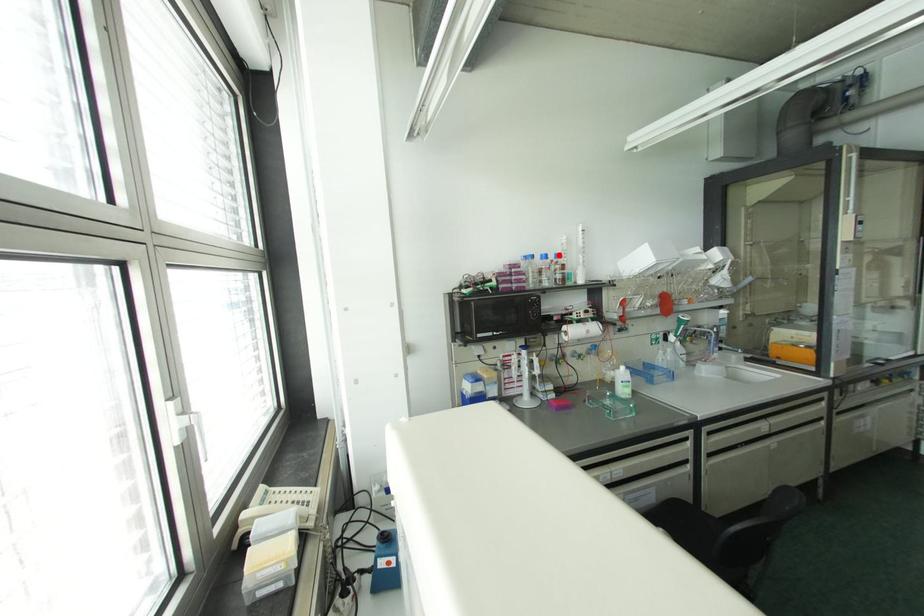
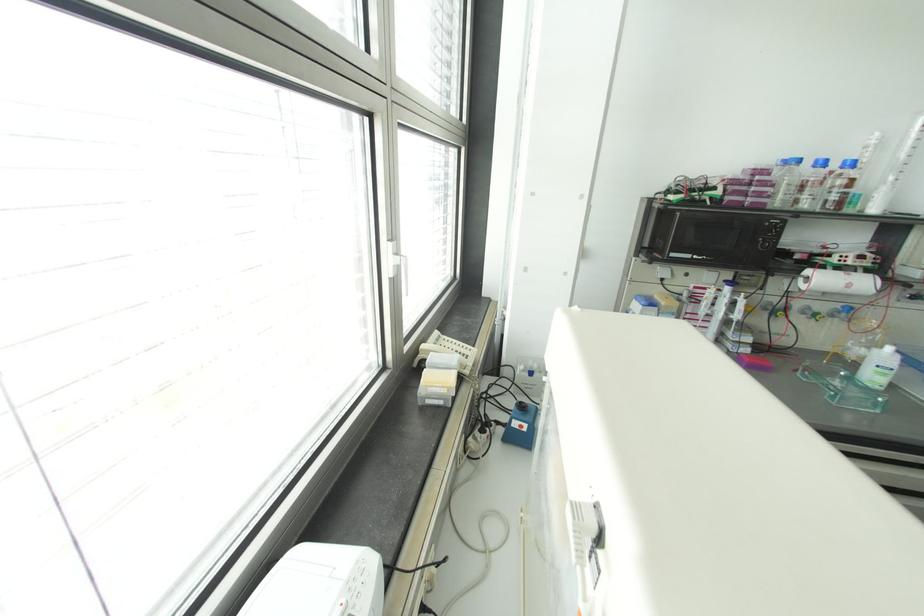
In the second image, find the point that corresponds to the highlighted location in the first image.

(852, 163)